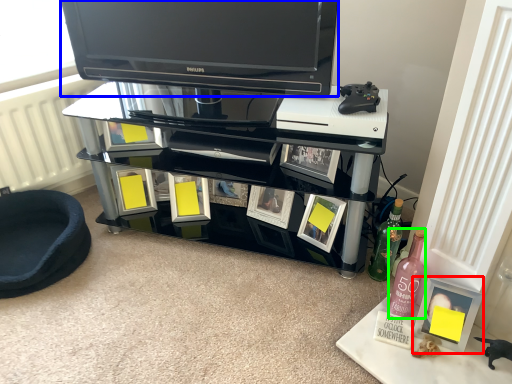
Question: Based on their relative distances, which object is farther from picture frame (highlighted by a red box)? Choose from television (highlighted by a blue box) and bottle (highlighted by a green box).

Choices:
 (A) television
 (B) bottle

Answer: (A)